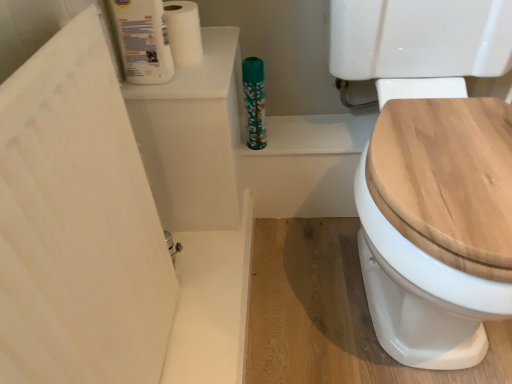
Image resolution: width=512 pixels, height=384 pixels. In order to click on free space to the right of white glossy toilet paper at upper left, placed as the second toilet paper when sorted from back to front in this screenshot , I will do `click(204, 71)`.